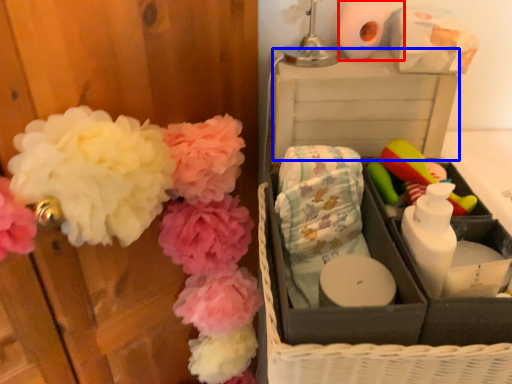
Question: Which of the following is the farthest to the observer, toilet paper (highlighted by a red box) or storage box (highlighted by a blue box)?

Choices:
 (A) toilet paper
 (B) storage box

Answer: (A)